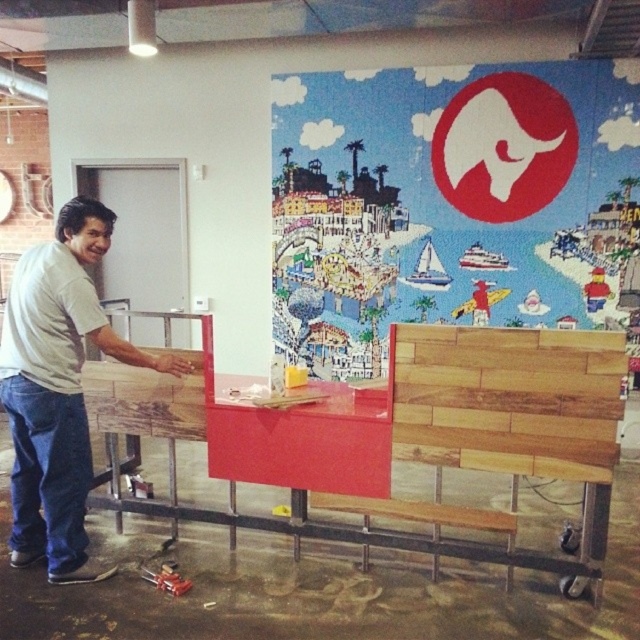
Question: Considering the relative positions of wooden at right and white t-shirt at left in the image provided, where is wooden at right located with respect to white t-shirt at left?

Choices:
 (A) right
 (B) left

Answer: (A)

Question: Which of the following is the farthest from the observer?

Choices:
 (A) (35, 388)
 (B) (586, 346)

Answer: (A)

Question: Is wooden at right below white t-shirt at left?

Choices:
 (A) no
 (B) yes

Answer: (A)

Question: Among these points, which one is nearest to the camera?

Choices:
 (A) (612, 368)
 (B) (61, 509)

Answer: (A)

Question: Does wooden at right appear on the left side of white t-shirt at left?

Choices:
 (A) no
 (B) yes

Answer: (A)

Question: Which object appears farthest from the camera in this image?

Choices:
 (A) white t-shirt at left
 (B) wooden at right

Answer: (A)